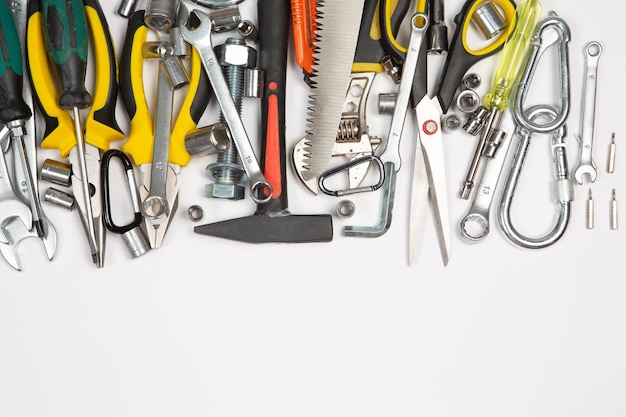
The height and width of the screenshot is (417, 626). I want to click on white tabletop, so click(278, 333).